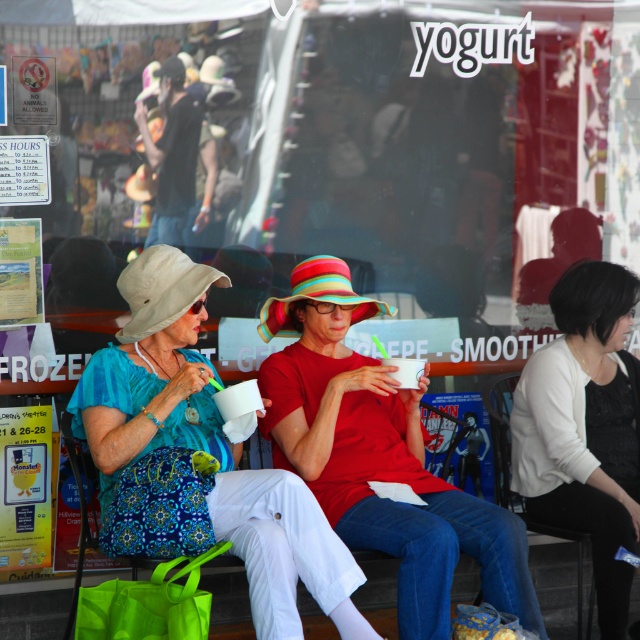
You are a customer entering the yogurt shop and see the bench with two people sitting on it. You want to sit next to the person wearing the white matte sweater at upper right. Is the person in the matte blue dress at center blocking your path to that spot?

The matte blue dress at center is closer to the viewer than the white matte sweater at upper right, so the person in the matte blue dress at center is blocking the path to the white matte sweater at upper right.

You are a customer waiting to enter the yogurt shop. You see the bench with the matte red shirt at center and the white matte sweater at upper right. Which item is sitting higher on the bench?

The matte red shirt at center is positioned over the white matte sweater at upper right, so it is sitting higher on the bench.